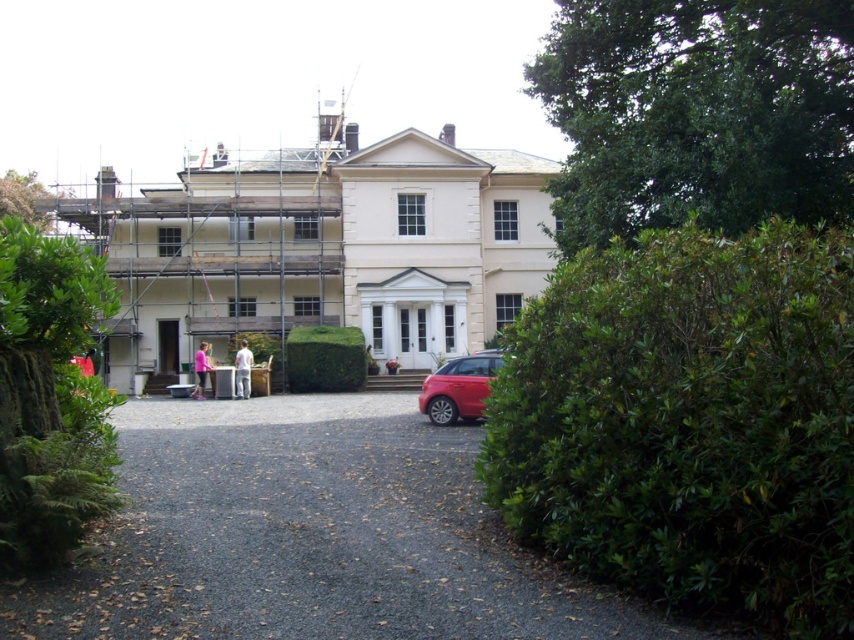
You are standing in front of the building and looking at two points marked on the facade. The first point is at coordinate point (647, 227) and the second is at point (27, 340). Which point is closer to your eyes?

Point (647, 227) is further to the viewer than point (27, 340), so the closer point to your eyes is point (27, 340).

You are standing in front of the two story classical building. You see a point marked at coordinates (697,113). What is located at that point?

The point at coordinates (697,113) marks a green leafy bush at upper right.